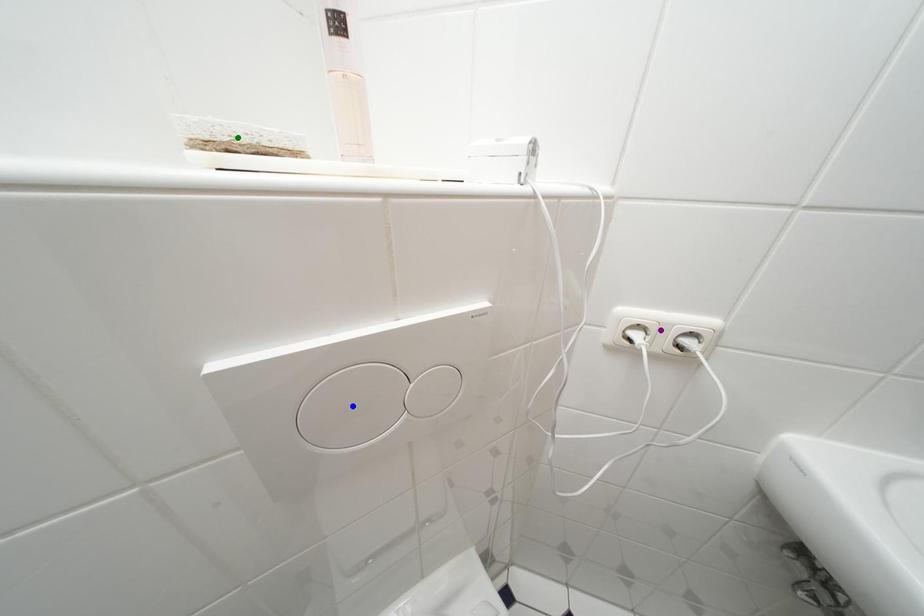
Order these from nearest to farthest:
green point, blue point, purple point

green point → blue point → purple point